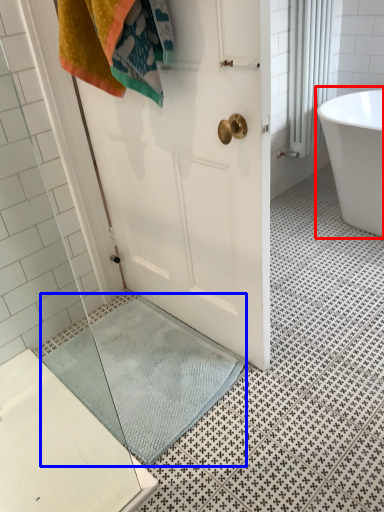
Question: Among these objects, which one is farthest to the camera, bathtub (highlighted by a red box) or bath mat (highlighted by a blue box)?

Choices:
 (A) bathtub
 (B) bath mat

Answer: (A)